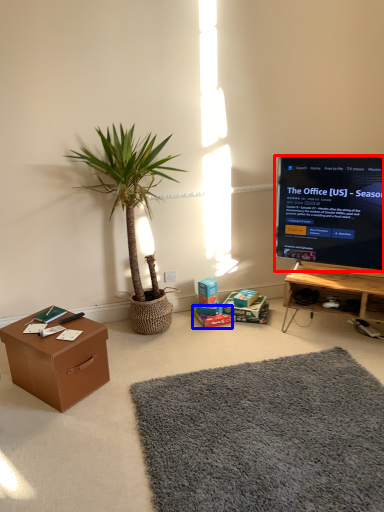
Question: Which point is closer to the camera, television (highlighted by a red box) or cardboard box (highlighted by a blue box)?

Choices:
 (A) television
 (B) cardboard box

Answer: (A)